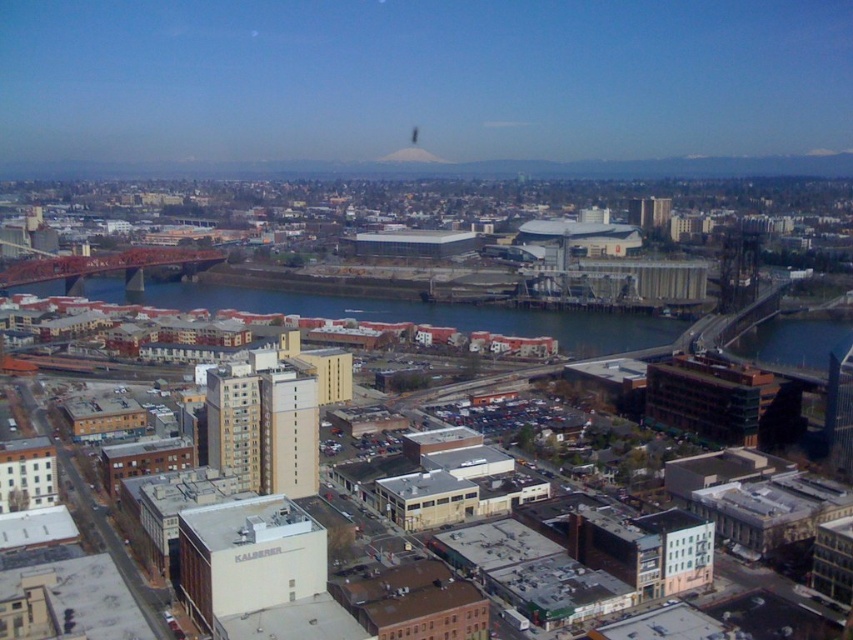
Question: Is blue water at center further to the viewer compared to white snow-covered mountain at upper center?

Choices:
 (A) no
 (B) yes

Answer: (A)

Question: Which point is farther from the camera taking this photo?

Choices:
 (A) (100, 273)
 (B) (424, 148)

Answer: (B)

Question: Does red painted steel bridge at left have a larger size compared to smooth gray mountain at upper center?

Choices:
 (A) yes
 (B) no

Answer: (A)

Question: Estimate the real-world distances between objects in this image. Which object is farther from the smooth gray mountain at upper center?

Choices:
 (A) white snow-covered mountain at upper center
 (B) blue water at center

Answer: (B)

Question: Based on their relative distances, which object is farther from the white snow-covered mountain at upper center?

Choices:
 (A) blue water at center
 (B) smooth gray mountain at upper center

Answer: (A)

Question: Can you confirm if smooth gray mountain at upper center is bigger than white snow-covered mountain at upper center?

Choices:
 (A) no
 (B) yes

Answer: (B)